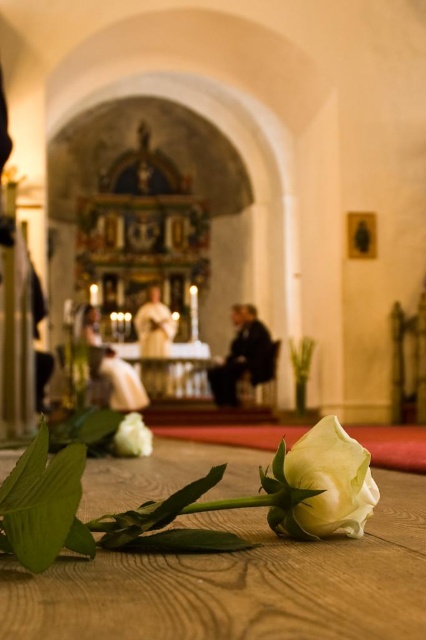
Does wooden table at lower center have a smaller size compared to white matte rose at lower left?

No, wooden table at lower center is not smaller than white matte rose at lower left.

This screenshot has width=426, height=640. Identify the location of wooden table at lower center. (239, 584).

Find the location of a particular element. wooden table at lower center is located at coordinates (239, 584).

Who is more forward, (x=362, y=480) or (x=141, y=428)?

Point (x=362, y=480) is more forward.

Does white matte rose at center have a greater height compared to white matte rose at lower left?

Incorrect, white matte rose at center's height is not larger of white matte rose at lower left's.

Does point (325, 432) lie in front of point (137, 440)?

Yes, point (325, 432) is closer to viewer.

Where is `white matte rose at center`? The height and width of the screenshot is (640, 426). white matte rose at center is located at coordinates (331, 481).

Is wooden table at lower center positioned in front of white matte rose at center?

That is True.

Does point (164, 560) lie in front of point (342, 518)?

Yes, point (164, 560) is closer to viewer.

Find the location of `wooden table at lower center`. wooden table at lower center is located at coordinates (239, 584).